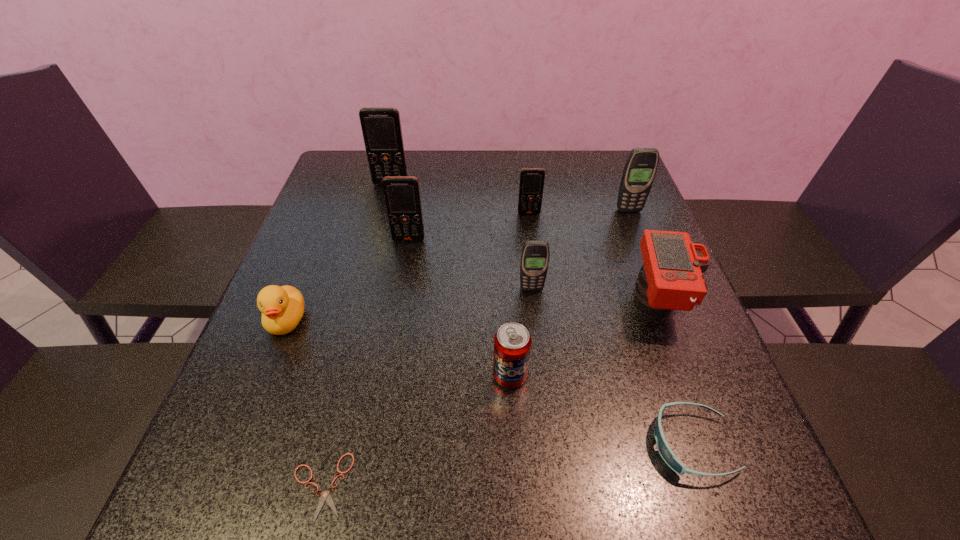
You are a GUI agent. You are given a task and a screenshot of the screen. Output one action in this format:
    pyautogui.click(x=<x>, y=<y>)
    Task: Click on the camera
    
    Given the screenshot: What is the action you would take?
    pyautogui.click(x=671, y=278)

The image size is (960, 540). Find the location of `red soda can`. red soda can is located at coordinates [512, 342].

This screenshot has height=540, width=960. What are the coordinates of `the eighth farthest object` in the screenshot? It's located at (512, 342).

Where is `yellow duck`? The width and height of the screenshot is (960, 540). yellow duck is located at coordinates (282, 308).

Image resolution: width=960 pixels, height=540 pixels. I want to click on the eighth tallest object, so click(282, 308).

I want to click on the second shortest object, so click(668, 456).

Identify the location of shears. This screenshot has width=960, height=540. point(325,496).

Find the location of a particular element. This screenshot has width=960, height=540. vacant region located 0.350m on the screen of the farthest cellular telephone is located at coordinates (369, 273).

What are the coordinates of `vacant space located on the screen of the bigger gray cellular telephone` in the screenshot? It's located at (643, 247).

The width and height of the screenshot is (960, 540). I want to click on free space located on the screen of the nearest orange cellular telephone, so click(x=395, y=319).